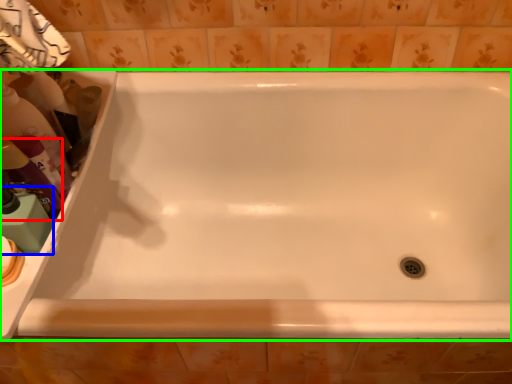
Question: Considering the real-world distances, which object is closest to cleaning product (highlighted by a red box)? cleaning product (highlighted by a blue box) or bathtub (highlighted by a green box).

Choices:
 (A) cleaning product
 (B) bathtub

Answer: (A)